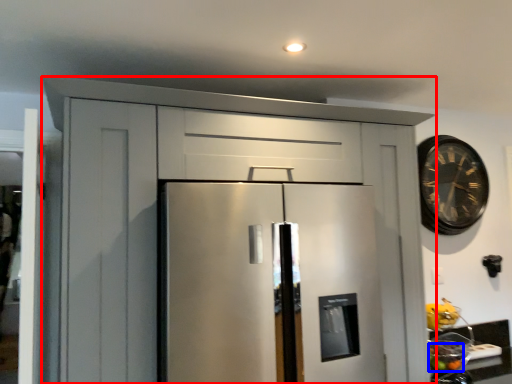
Question: Which object is closer to the camera taking this photo, cabinetry (highlighted by a red box) or fruit (highlighted by a blue box)?

Choices:
 (A) cabinetry
 (B) fruit

Answer: (A)